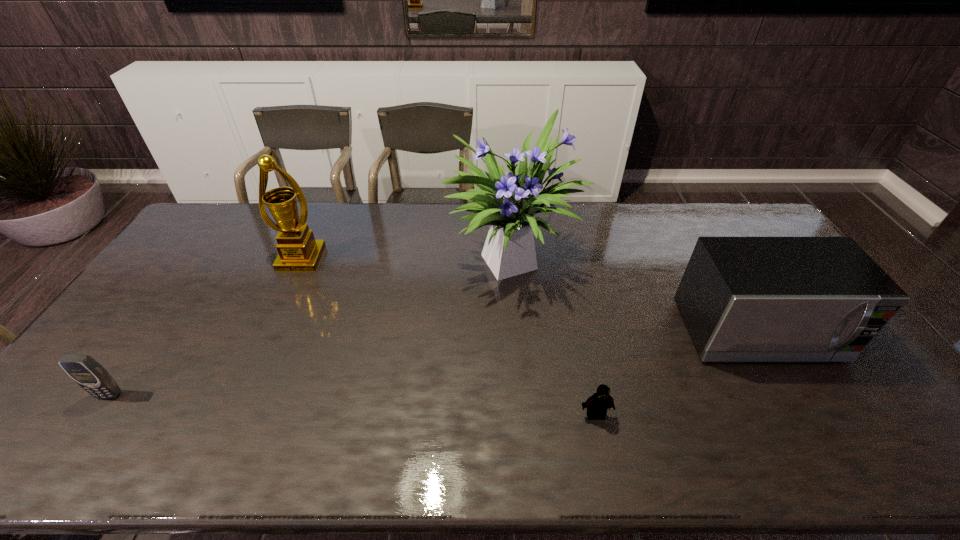
The height and width of the screenshot is (540, 960). Identify the location of free location at the far left corner. (244, 214).

Where is `unoccupied position between the tallest object and the rightmost object`? unoccupied position between the tallest object and the rightmost object is located at coordinates (636, 295).

Where is `free spot between the nearest object and the leftmost object`? The image size is (960, 540). free spot between the nearest object and the leftmost object is located at coordinates (352, 405).

Find the location of a particular element. vacant region between the second nearest object and the tallest object is located at coordinates (312, 326).

Image resolution: width=960 pixels, height=540 pixels. Identify the location of free space that is in between the award and the rightmost object. (530, 296).

Identify the location of vacant area between the Lego and the tallest object. (555, 336).

What are the coordinates of `free space between the flower arrangement and the cellular telephone` in the screenshot? It's located at (312, 326).

Locate an element on the screen. Image resolution: width=960 pixels, height=540 pixels. vacant point located between the tallest object and the cellular telephone is located at coordinates pyautogui.click(x=312, y=326).

You are a GUI agent. You are given a task and a screenshot of the screen. Output one action in this format:
    pyautogui.click(x=<x>, y=<y>)
    Task: Click on the free space between the shortest object and the third shortest object
    The height and width of the screenshot is (540, 960).
    Given the screenshot: What is the action you would take?
    pyautogui.click(x=677, y=374)

The image size is (960, 540). I want to click on empty location between the tallest object and the second tallest object, so click(x=408, y=258).